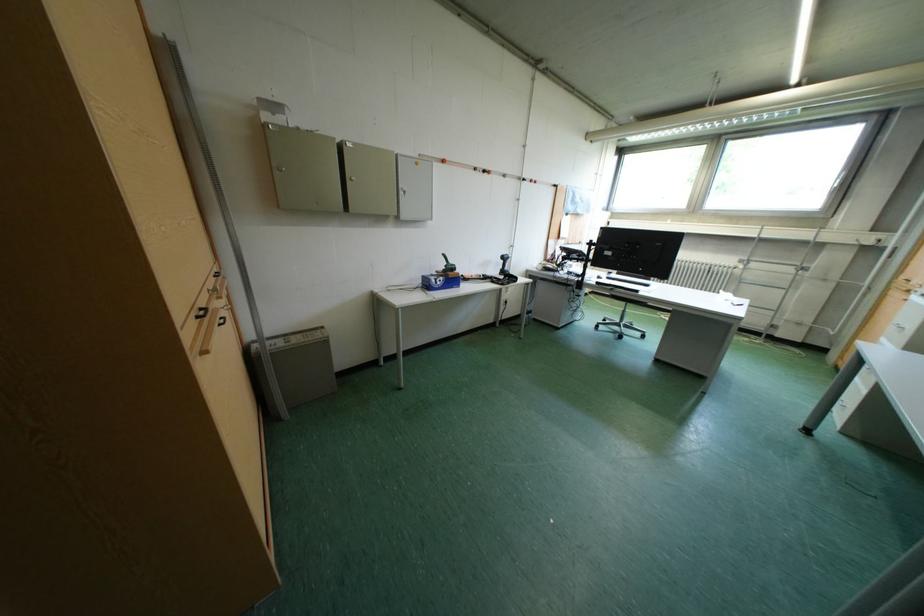
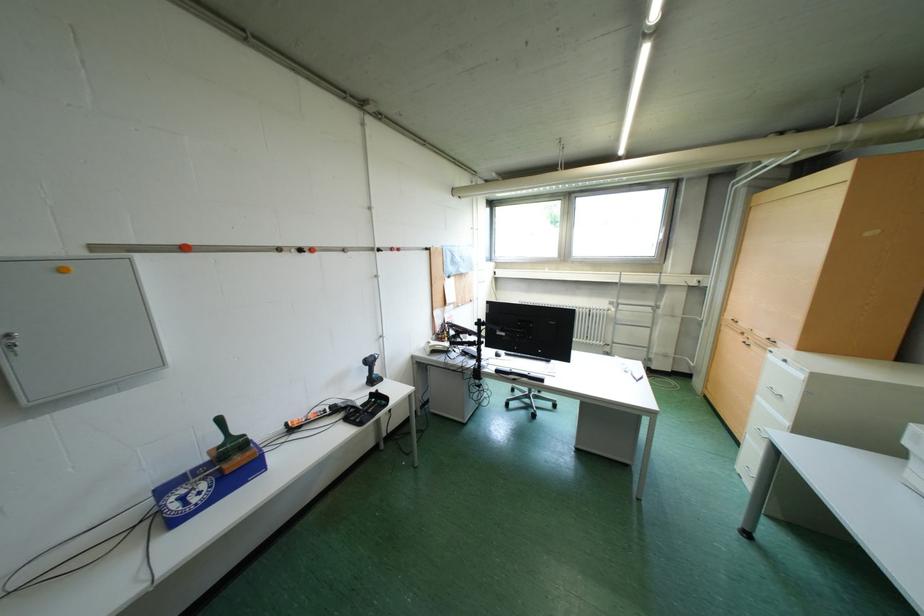
The images are taken continuously from a first-person perspective. In which direction are you moving?

The cameraman walked toward right, forward.